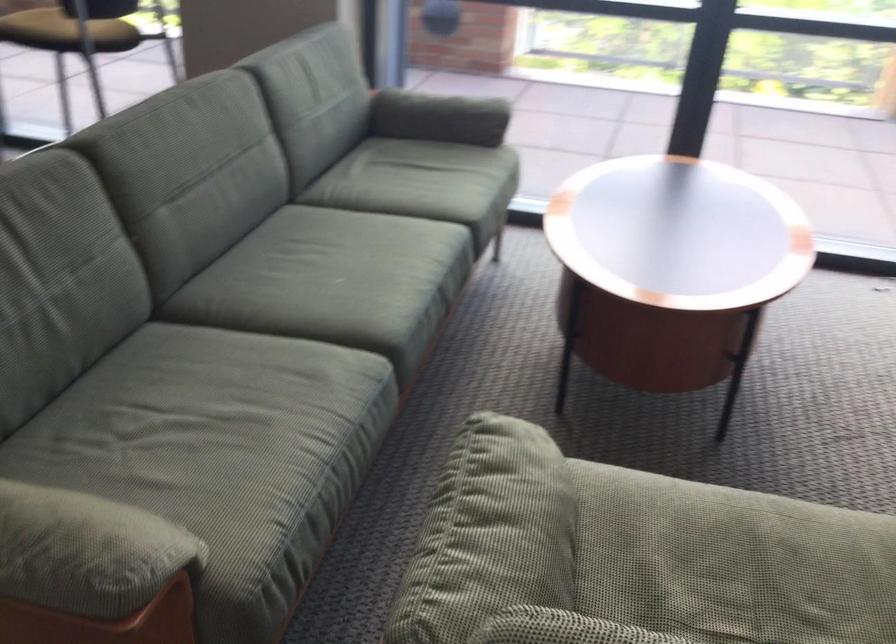
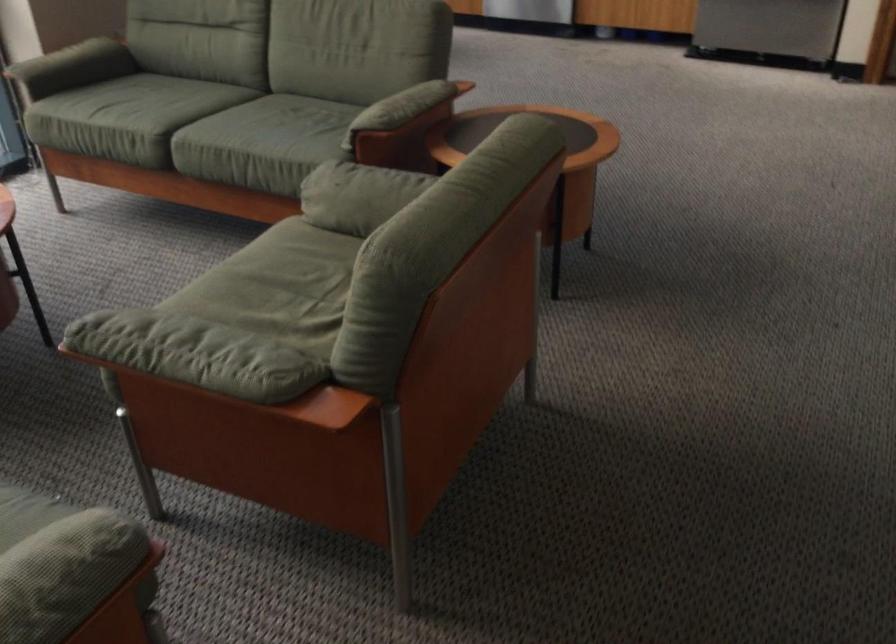
Based on the continuous images, in which direction is the camera rotating?

The camera rotated toward right-down.